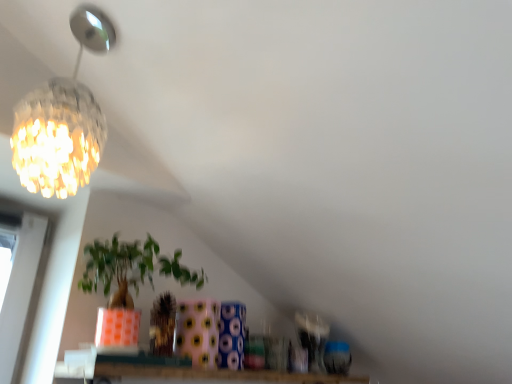
Question: From the image's perspective, relative to crystalline glass chandelier at upper left, is matte orange pot at center above or below?

Choices:
 (A) below
 (B) above

Answer: (A)

Question: Would you say matte orange pot at center is to the left or to the right of crystalline glass chandelier at upper left in the picture?

Choices:
 (A) left
 (B) right

Answer: (B)

Question: Estimate the real-world distances between objects in this image. Which object is closer to the matte orange pot at center?

Choices:
 (A) crystalline glass chandelier at upper left
 (B) transparent glass window at lower center

Answer: (B)

Question: Estimate the real-world distances between objects in this image. Which object is closer to the matte orange pot at center?

Choices:
 (A) crystalline glass chandelier at upper left
 (B) transparent glass window at lower center

Answer: (B)